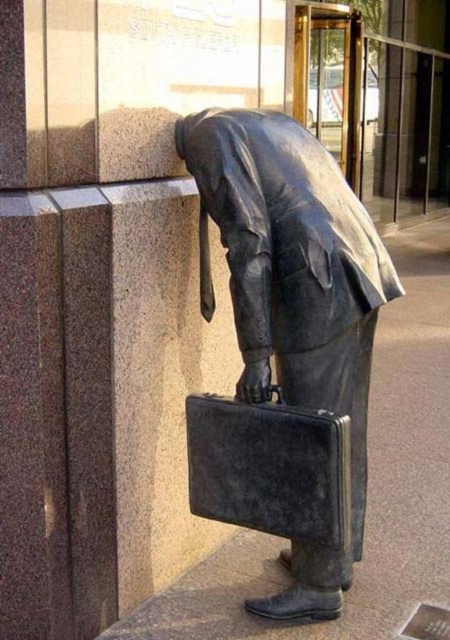
Can you confirm if bronze statue at center is positioned to the right of black leather briefcase at center?

Correct, you'll find bronze statue at center to the right of black leather briefcase at center.

Who is shorter, bronze statue at center or black leather briefcase at center?

black leather briefcase at center

What do you see at coordinates (293, 298) in the screenshot?
I see `bronze statue at center` at bounding box center [293, 298].

In order to click on bronze statue at center in this screenshot , I will do `click(293, 298)`.